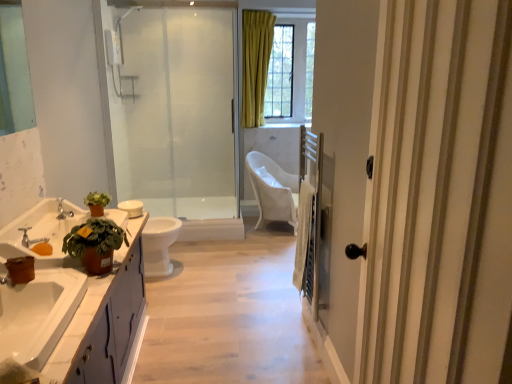
I want to click on white wood door at right, so click(x=416, y=187).

The width and height of the screenshot is (512, 384). Describe the element at coordinates (159, 245) in the screenshot. I see `white glossy toilet at center` at that location.

Image resolution: width=512 pixels, height=384 pixels. What do you see at coordinates (179, 118) in the screenshot?
I see `transparent glass shower door at center` at bounding box center [179, 118].

The image size is (512, 384). Describe the element at coordinates (63, 210) in the screenshot. I see `silver metallic faucet at lower left, which ranks as the first tap in top-to-bottom order` at that location.

What is the approximate height of silver metallic faucet at lower left, positioned as the second tap in bottom-to-top order?

It is 4.86 inches.

Identify the location of white glossy sink at lower left, which is the first sink in front-to-back order. (38, 314).

This screenshot has height=384, width=512. What are the coordinates of `white wood door at right` in the screenshot? It's located at (416, 187).

Could you tell me if silver metallic faucet at lower left, the 2th tap in the top-to-bottom sequence, is facing white glossy sink at lower left, the second sink when ordered from front to back?

Yes, silver metallic faucet at lower left, the 2th tap in the top-to-bottom sequence, is oriented towards white glossy sink at lower left, the second sink when ordered from front to back.

Consider the image. Between silver metallic faucet at lower left, the 1th tap from the front, and white glossy sink at lower left, the second sink when ordered from front to back, which one has larger size?

Bigger between the two is white glossy sink at lower left, the second sink when ordered from front to back.

Is silver metallic faucet at lower left, marked as the second tap in a back-to-front arrangement, further to camera compared to white glossy sink at lower left, the second sink when ordered from front to back?

Yes, the depth of silver metallic faucet at lower left, marked as the second tap in a back-to-front arrangement, is greater than that of white glossy sink at lower left, the second sink when ordered from front to back.

From the image's perspective, is silver metallic faucet at lower left, marked as the first tap in a bottom-to-top arrangement, below white glossy sink at lower left, which is the first sink from back to front?

No.

Which object is wider, white glossy toilet bowl at center or white glossy cabinet at lower left?

Wider between the two is white glossy toilet bowl at center.

Is white glossy toilet bowl at center further to camera compared to white glossy cabinet at lower left?

Yes, it is behind white glossy cabinet at lower left.

From the image's perspective, is white glossy toilet bowl at center beneath white glossy cabinet at lower left?

Actually, white glossy toilet bowl at center appears above white glossy cabinet at lower left in the image.

Considering the positions of point (128, 212) and point (127, 312), is point (128, 212) closer or farther from the camera than point (127, 312)?

Point (128, 212).

Who is bigger, white glossy sink at lower left, the second sink when ordered from front to back, or green matte plant at left?

white glossy sink at lower left, the second sink when ordered from front to back, is bigger.

In order to click on the 2nd sink to the left when counting from the green matte plant at left in this screenshot , I will do `click(42, 234)`.

From the image's perspective, which object appears higher, white glossy sink at lower left, the second sink when ordered from front to back, or green matte plant at left?

green matte plant at left, from the image's perspective.

How far apart are white glossy sink at lower left, the second sink when ordered from front to back, and green matte plant at left?

white glossy sink at lower left, the second sink when ordered from front to back, and green matte plant at left are 24.17 centimeters apart from each other.

What's the angular difference between white glossy sink at lower left, which is the first sink in front-to-back order, and white glossy sink at lower left, the second sink when ordered from front to back,'s facing directions?

The angle between the facing direction of white glossy sink at lower left, which is the first sink in front-to-back order, and the facing direction of white glossy sink at lower left, the second sink when ordered from front to back, is 0.00127 degrees.

In the scene shown: From the image's perspective, between white glossy sink at lower left, which is the first sink in front-to-back order, and white glossy sink at lower left, the second sink when ordered from front to back, which one is located above?

white glossy sink at lower left, the second sink when ordered from front to back, appears higher in the image.

Does white glossy sink at lower left, which is the first sink in front-to-back order, touch white glossy sink at lower left, the second sink when ordered from front to back?

No.

From a real-world perspective, between white glossy sink at lower left, which is the first sink in front-to-back order, and white glossy sink at lower left, which is the first sink from back to front, who is vertically lower?

white glossy sink at lower left, which is the first sink from back to front.

In terms of width, does white glossy cabinet at lower left look wider or thinner when compared to wooden balustrade at right?

Clearly, white glossy cabinet at lower left has less width compared to wooden balustrade at right.

Who is shorter, white glossy cabinet at lower left or wooden balustrade at right?

white glossy cabinet at lower left is shorter.

From a real-world perspective, is white glossy cabinet at lower left positioned under wooden balustrade at right based on gravity?

Yes.

Between yellow fabric curtain at upper center and white glossy cabinet at lower left, which one appears on the left side from the viewer's perspective?

white glossy cabinet at lower left.

Is yellow fabric curtain at upper center looking in the opposite direction of white glossy cabinet at lower left?

No, yellow fabric curtain at upper center is not facing the opposite direction of white glossy cabinet at lower left.

Which of these two, yellow fabric curtain at upper center or white glossy cabinet at lower left, stands taller?

With more height is yellow fabric curtain at upper center.

Can you see yellow fabric curtain at upper center touching white glossy cabinet at lower left?

They are not placed beside each other.

From a real-world perspective, is yellow fabric curtain at upper center positioned over silver metallic faucet at lower left, positioned as the second tap in bottom-to-top order, based on gravity?

Yes, from a real-world perspective, yellow fabric curtain at upper center is on top of silver metallic faucet at lower left, positioned as the second tap in bottom-to-top order.

From the image's perspective, which one is positioned higher, yellow fabric curtain at upper center or silver metallic faucet at lower left, which ranks as the first tap in top-to-bottom order?

yellow fabric curtain at upper center, from the image's perspective.

Does yellow fabric curtain at upper center appear on the right side of silver metallic faucet at lower left, which ranks as the first tap in top-to-bottom order?

Correct, you'll find yellow fabric curtain at upper center to the right of silver metallic faucet at lower left, which ranks as the first tap in top-to-bottom order.

The height and width of the screenshot is (384, 512). I want to click on the 2nd sink directly beneath the silver metallic faucet at lower left, marked as the second tap in a back-to-front arrangement (from a real-world perspective), so click(x=42, y=234).

At what (x,y) coordinates should I click in order to perform the action: click on toilet bowl behind the white glossy cabinet at lower left. Please return your answer as a coordinate pair (x, y). Looking at the image, I should click on (132, 208).

Which object lies further to the anchor point silver metallic faucet at lower left, placed as the second tap when sorted from front to back, yellow fabric curtain at upper center or silver metallic faucet at lower left, marked as the first tap in a bottom-to-top arrangement?

yellow fabric curtain at upper center is positioned further to the anchor silver metallic faucet at lower left, placed as the second tap when sorted from front to back.

Looking at the image, which one is located further to white glossy sink at lower left, which is the first sink from back to front, green matte plant at left or white glossy cabinet at lower left?

white glossy cabinet at lower left lies further to white glossy sink at lower left, which is the first sink from back to front, than the other object.

Considering their positions, is green matte plant at left positioned closer to white glossy cabinet at lower left than white wood door at right?

Based on the image, green matte plant at left appears to be nearer to white glossy cabinet at lower left.

Looking at the image, which one is located closer to yellow fabric curtain at upper center, white glossy sink at lower left, the second sink when ordered from front to back, or transparent glass shower door at center?

Based on the image, transparent glass shower door at center appears to be nearer to yellow fabric curtain at upper center.

Which object lies nearer to the anchor point white glossy toilet bowl at center, silver metallic faucet at lower left, the 2th tap in the top-to-bottom sequence, or green matte plant at left?

Based on the image, silver metallic faucet at lower left, the 2th tap in the top-to-bottom sequence, appears to be nearer to white glossy toilet bowl at center.

Looking at the image, which one is located further to woven white chair at center, green matte plant at left or white wood door at right?

green matte plant at left is positioned further to the anchor woven white chair at center.

Estimate the real-world distances between objects in this image. Which object is further from white wood door at right, white glossy toilet bowl at center or white glossy cabinet at lower left?

Based on the image, white glossy toilet bowl at center appears to be further to white wood door at right.

In the scene shown: Based on their spatial positions, is wooden balustrade at right or white glossy cabinet at lower left closer to white glossy toilet at center?

white glossy cabinet at lower left is positioned closer to the anchor white glossy toilet at center.

The height and width of the screenshot is (384, 512). I want to click on houseplant positioned between white glossy cabinet at lower left and white glossy sink at lower left, the second sink when ordered from front to back, from near to far, so click(x=95, y=244).

Where is `toilet between white wood door at right and yellow fabric curtain at upper center from front to back`? This screenshot has height=384, width=512. toilet between white wood door at right and yellow fabric curtain at upper center from front to back is located at coordinates (159, 245).

Where is `houseplant between white glossy cabinet at lower left and white glossy toilet bowl at center from front to back`? houseplant between white glossy cabinet at lower left and white glossy toilet bowl at center from front to back is located at coordinates (95, 244).

This screenshot has width=512, height=384. I want to click on tap between silver metallic faucet at lower left, marked as the first tap in a bottom-to-top arrangement, and transparent glass shower door at center, along the z-axis, so click(63, 210).